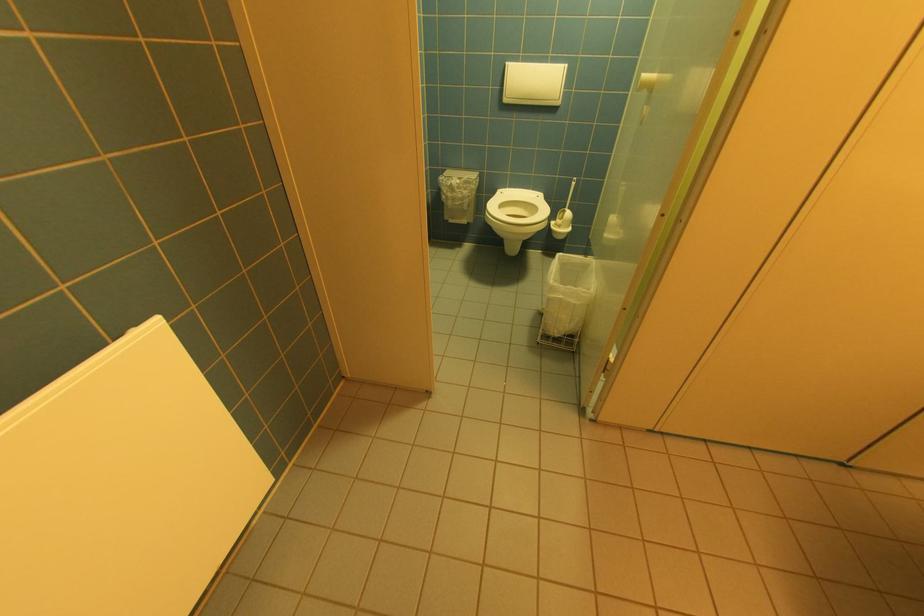
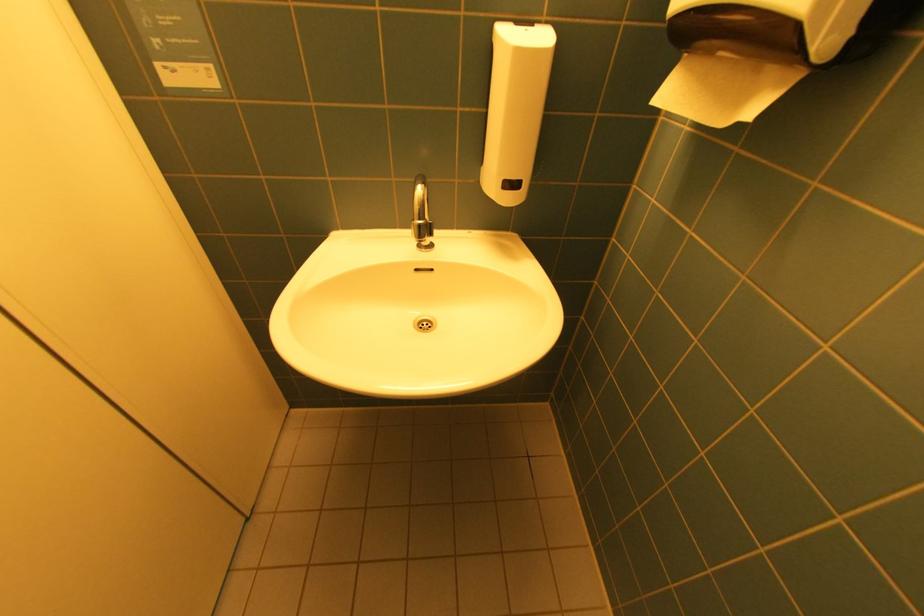
Based on the continuous images, in which direction is the camera rotating?

The camera's rotation is toward right-down.